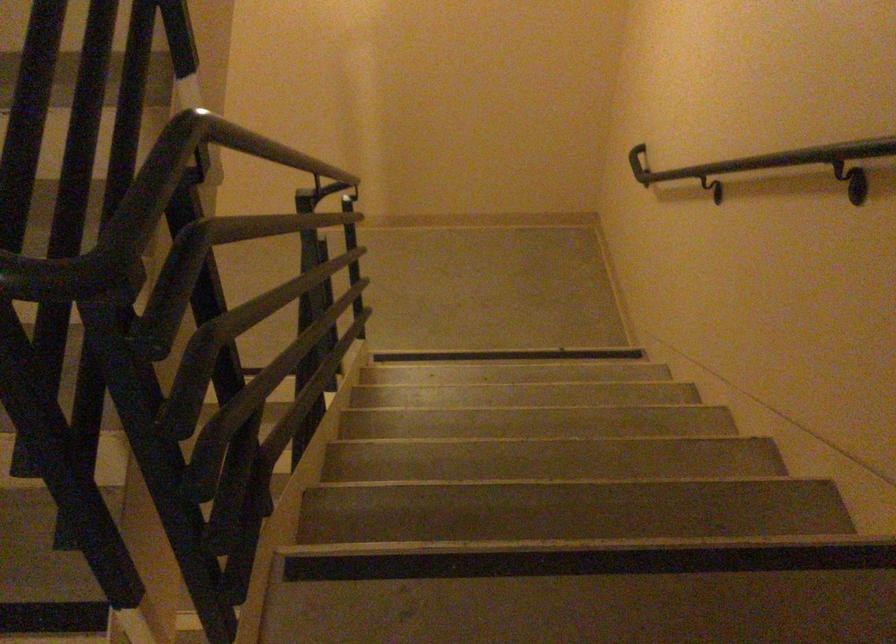
Where is `black handrail`? The image size is (896, 644). black handrail is located at coordinates (271, 152).